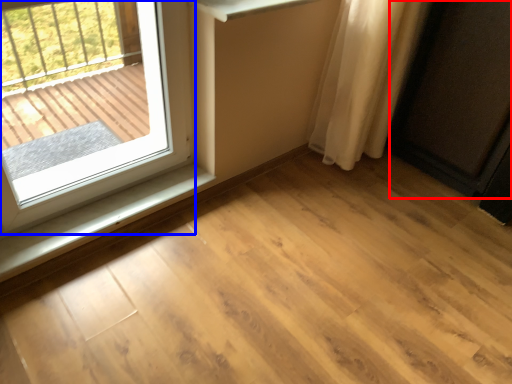
Question: Which of the following is the closest to the observer, screen door (highlighted by a red box) or window (highlighted by a blue box)?

Choices:
 (A) screen door
 (B) window

Answer: (B)